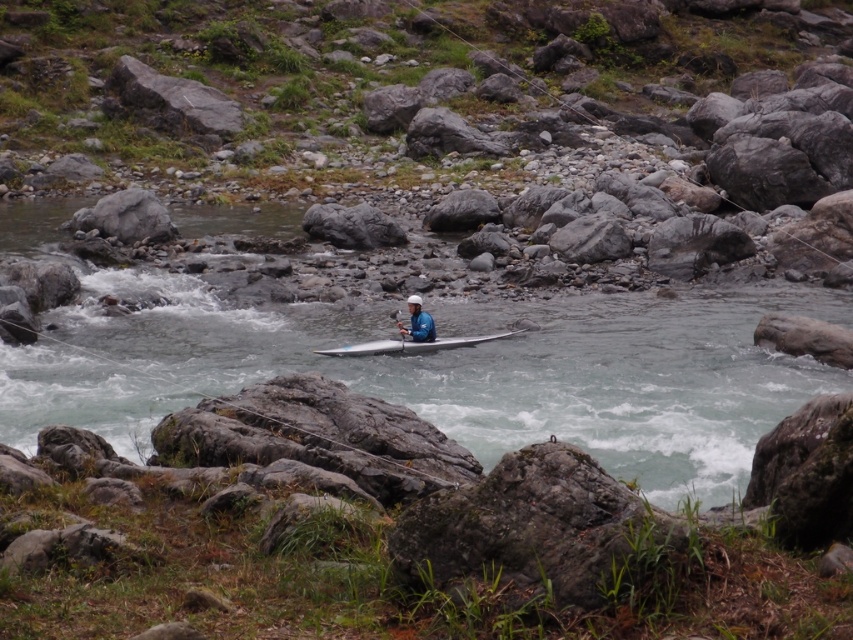
Is white plastic kayak at center taller than blue fabric helmet at center?

In fact, white plastic kayak at center may be shorter than blue fabric helmet at center.

Is point (419, 344) positioned before point (433, 332)?

Yes, point (419, 344) is in front of point (433, 332).

Where is `white plastic kayak at center`? white plastic kayak at center is located at coordinates (413, 344).

Does point (430, 330) lie behind point (399, 339)?

That is False.

Who is higher up, blue fabric helmet at center or white plastic paddle at center?

blue fabric helmet at center is higher up.

This screenshot has height=640, width=853. Identify the location of blue fabric helmet at center. (416, 321).

Who is higher up, white plastic kayak at center or white plastic paddle at center?

white plastic paddle at center is higher up.

The height and width of the screenshot is (640, 853). I want to click on white plastic kayak at center, so click(413, 344).